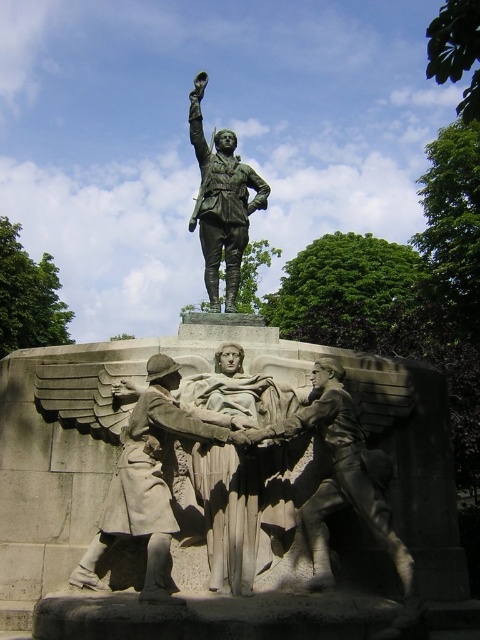
You are a visitor at the statue and want to take a photo that includes both the bronze statue of soldier at center and the bronze statue at upper center. Which one should you focus on first to ensure both are in frame?

You should focus on the bronze statue of soldier at center first because it is located below the bronze statue at upper center, so adjusting the camera angle to include both would require framing from the lower to upper part of the statue.